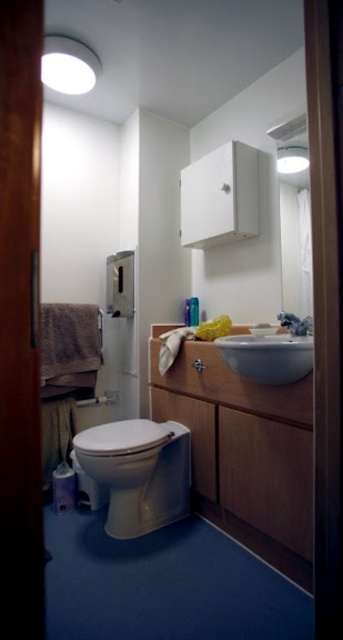
Question: Which object is the closest to the satin silver faucet at sink right?

Choices:
 (A) white glossy sink at center
 (B) white glossy toilet bowl at center
 (C) wooden vanity at center

Answer: (A)

Question: Which point is closer to the camera?

Choices:
 (A) (284, 317)
 (B) (250, 458)
 (C) (299, 339)
 (D) (148, 496)

Answer: (C)

Question: Which point is farther from the camera taking this photo?

Choices:
 (A) (299, 332)
 (B) (208, 440)
 (C) (99, 481)
 (D) (306, 365)

Answer: (B)

Question: Does wooden vanity at center appear under satin silver faucet at sink right?

Choices:
 (A) yes
 (B) no

Answer: (A)

Question: Is white glossy toilet bowl at center wider than satin silver faucet at sink right?

Choices:
 (A) yes
 (B) no

Answer: (A)

Question: Observing the image, what is the correct spatial positioning of wooden vanity at center in reference to satin silver faucet at sink right?

Choices:
 (A) left
 (B) right

Answer: (A)